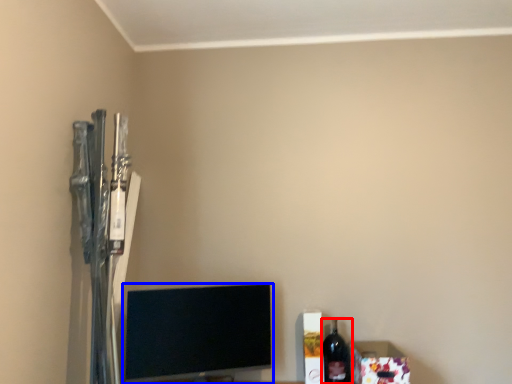
Question: Which object is closer to the camera taking this photo, bottle (highlighted by a red box) or television (highlighted by a blue box)?

Choices:
 (A) bottle
 (B) television

Answer: (B)